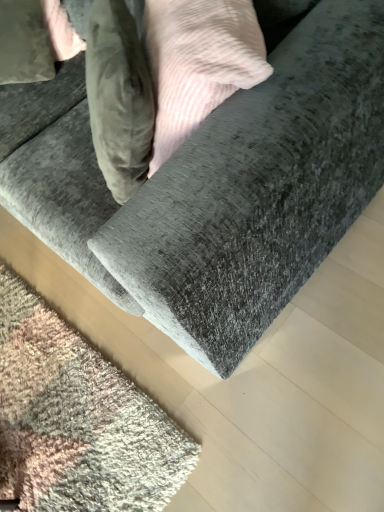
Locate an element on the screen. This screenshot has height=512, width=384. velvet gray couch at upper center is located at coordinates (225, 191).

What do you see at coordinates (225, 191) in the screenshot?
I see `velvet gray couch at upper center` at bounding box center [225, 191].

The width and height of the screenshot is (384, 512). In order to click on velvet gray couch at upper center in this screenshot , I will do `click(225, 191)`.